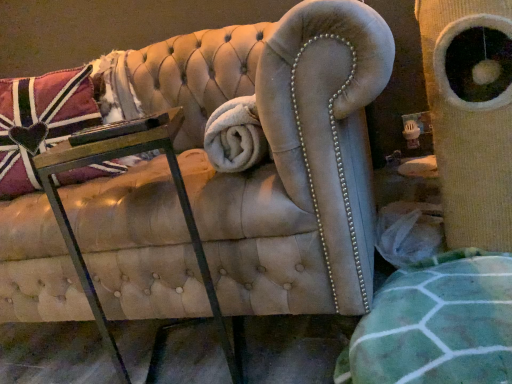
Locate an element on the screen. The image size is (512, 384). velvet union jack pillow at upper left is located at coordinates (42, 120).

The width and height of the screenshot is (512, 384). Describe the element at coordinates (42, 120) in the screenshot. I see `velvet union jack pillow at upper left` at that location.

Locate an element on the screen. metal/glass table at lower left is located at coordinates (110, 159).

The height and width of the screenshot is (384, 512). What do you see at coordinates (110, 159) in the screenshot? I see `metal/glass table at lower left` at bounding box center [110, 159].

Locate an element on the screen. This screenshot has height=384, width=512. velvet union jack pillow at upper left is located at coordinates (42, 120).

Is velvet union jack pillow at upper left to the left of metal/glass table at lower left from the viewer's perspective?

Yes.

Which object is further away from the camera taking this photo, velvet union jack pillow at upper left or metal/glass table at lower left?

velvet union jack pillow at upper left is further from the camera.

Does point (48, 147) appear closer or farther from the camera than point (34, 155)?

Point (48, 147).

From the image's perspective, does velvet union jack pillow at upper left appear higher than metal/glass table at lower left?

Yes, from the image's perspective, velvet union jack pillow at upper left is over metal/glass table at lower left.

From a real-world perspective, who is located higher, velvet union jack pillow at upper left or metal/glass table at lower left?

velvet union jack pillow at upper left is physically above.

Is velvet union jack pillow at upper left wider than metal/glass table at lower left?

No, velvet union jack pillow at upper left is not wider than metal/glass table at lower left.

Considering the relative sizes of velvet union jack pillow at upper left and metal/glass table at lower left in the image provided, is velvet union jack pillow at upper left taller than metal/glass table at lower left?

No.

Can you confirm if velvet union jack pillow at upper left is bigger than metal/glass table at lower left?

Correct, velvet union jack pillow at upper left is larger in size than metal/glass table at lower left.

Is velvet union jack pillow at upper left situated inside metal/glass table at lower left or outside?

velvet union jack pillow at upper left exists outside the volume of metal/glass table at lower left.

Is velvet union jack pillow at upper left beside metal/glass table at lower left?

No, velvet union jack pillow at upper left is not beside metal/glass table at lower left.

Is velvet union jack pillow at upper left positioned with its back to metal/glass table at lower left?

That's not correct — velvet union jack pillow at upper left is not looking away from metal/glass table at lower left.

What's the angular difference between velvet union jack pillow at upper left and metal/glass table at lower left's facing directions?

The angle between the facing direction of velvet union jack pillow at upper left and the facing direction of metal/glass table at lower left is 168 degrees.

At what (x,y) coordinates should I click in order to perform the action: click on throw pillow that appears above the metal/glass table at lower left (from the image's perspective). Please return your answer as a coordinate pair (x, y). This screenshot has width=512, height=384. Looking at the image, I should click on [x=42, y=120].

Considering the relative positions of metal/glass table at lower left and velvet union jack pillow at upper left in the image provided, is metal/glass table at lower left to the left or to the right of velvet union jack pillow at upper left?

Based on their positions, metal/glass table at lower left is located to the right of velvet union jack pillow at upper left.

Which object is more forward, metal/glass table at lower left or velvet union jack pillow at upper left?

metal/glass table at lower left is in front.

Does point (117, 349) appear closer or farther from the camera than point (67, 72)?

Point (117, 349) appears to be closer to the viewer than point (67, 72).

From the image's perspective, is metal/glass table at lower left over velvet union jack pillow at upper left?

No, from the image's perspective, metal/glass table at lower left is not over velvet union jack pillow at upper left.

From a real-world perspective, is metal/glass table at lower left physically located above or below velvet union jack pillow at upper left?

metal/glass table at lower left is situated lower than velvet union jack pillow at upper left in the real world.

Can you confirm if metal/glass table at lower left is wider than velvet union jack pillow at upper left?

Indeed, metal/glass table at lower left has a greater width compared to velvet union jack pillow at upper left.

Considering the relative sizes of metal/glass table at lower left and velvet union jack pillow at upper left in the image provided, is metal/glass table at lower left shorter than velvet union jack pillow at upper left?

No, metal/glass table at lower left is not shorter than velvet union jack pillow at upper left.

Does metal/glass table at lower left have a smaller size compared to velvet union jack pillow at upper left?

Yes, metal/glass table at lower left is smaller than velvet union jack pillow at upper left.

Can velvet union jack pillow at upper left be found inside metal/glass table at lower left?

Actually, velvet union jack pillow at upper left is outside metal/glass table at lower left.

Are metal/glass table at lower left and velvet union jack pillow at upper left located far from each other?

That's not correct — metal/glass table at lower left is a little close to velvet union jack pillow at upper left.

Is metal/glass table at lower left facing towards velvet union jack pillow at upper left?

No, metal/glass table at lower left is not turned towards velvet union jack pillow at upper left.

What's the angular difference between metal/glass table at lower left and velvet union jack pillow at upper left's facing directions?

168 degrees separate the facing orientations of metal/glass table at lower left and velvet union jack pillow at upper left.

The image size is (512, 384). I want to click on throw pillow on the left of the metal/glass table at lower left, so click(x=42, y=120).

Locate an element on the screen. The width and height of the screenshot is (512, 384). throw pillow above the metal/glass table at lower left (from the image's perspective) is located at coordinates point(42,120).

This screenshot has width=512, height=384. What are the coordinates of `table that is below the velvet union jack pillow at upper left (from the image's perspective)` in the screenshot? It's located at (110, 159).